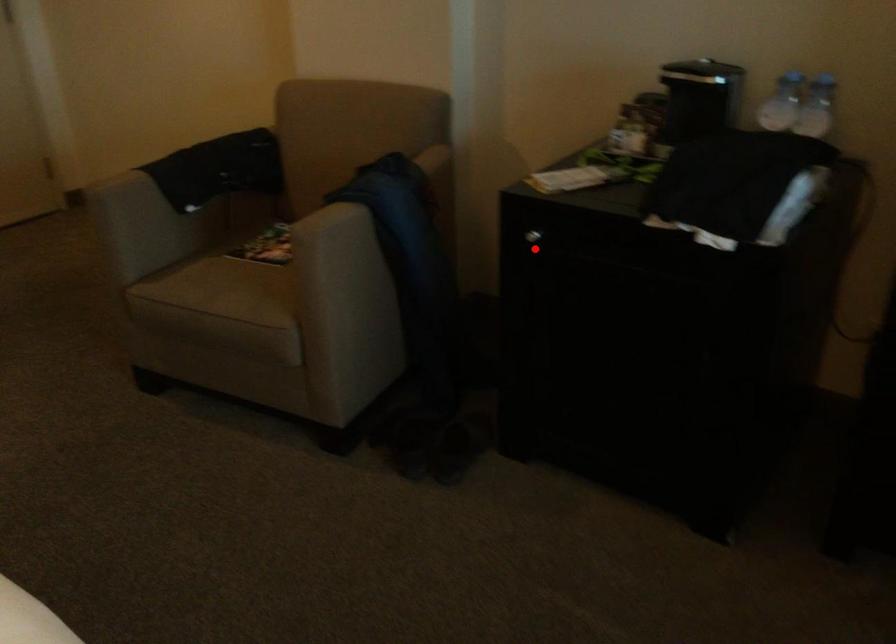
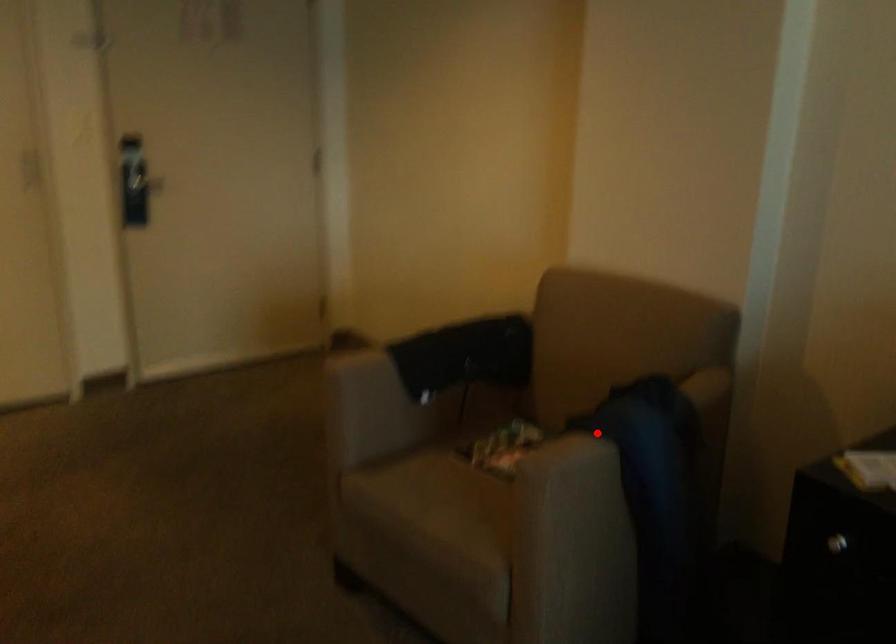
In the scene shown: I am providing you with two images of the same scene from different viewpoints. A red point is marked on the first image and another point is marked on the second image. Are the points marked in image1 and image2 representing the same 3D position?

No